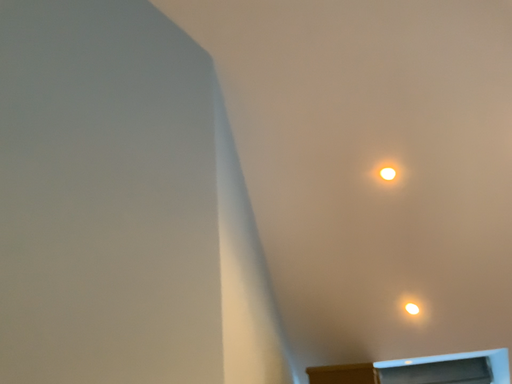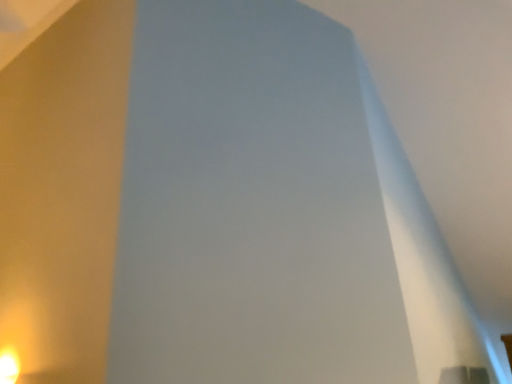
Question: How did the camera likely rotate when shooting the video?

Choices:
 (A) rotated right
 (B) rotated left

Answer: (B)